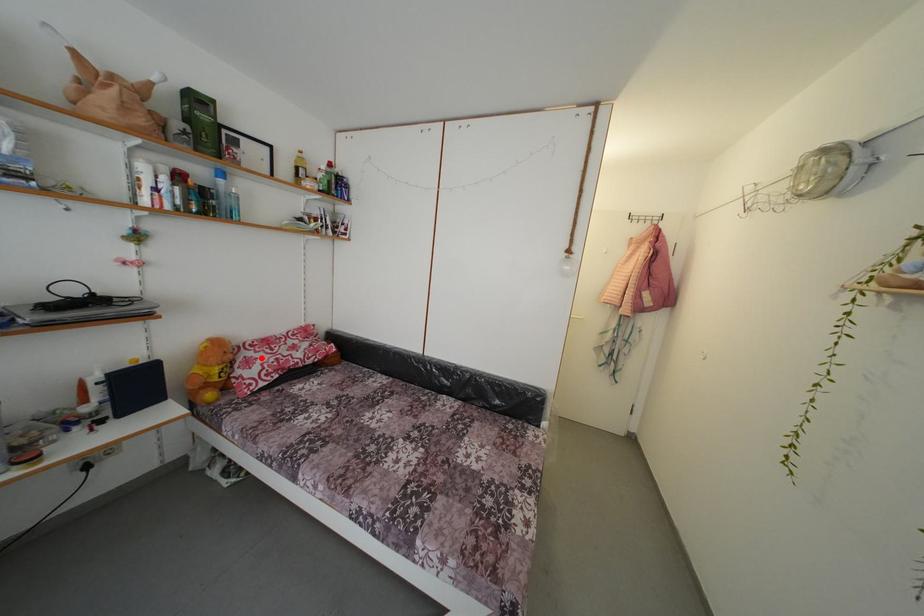
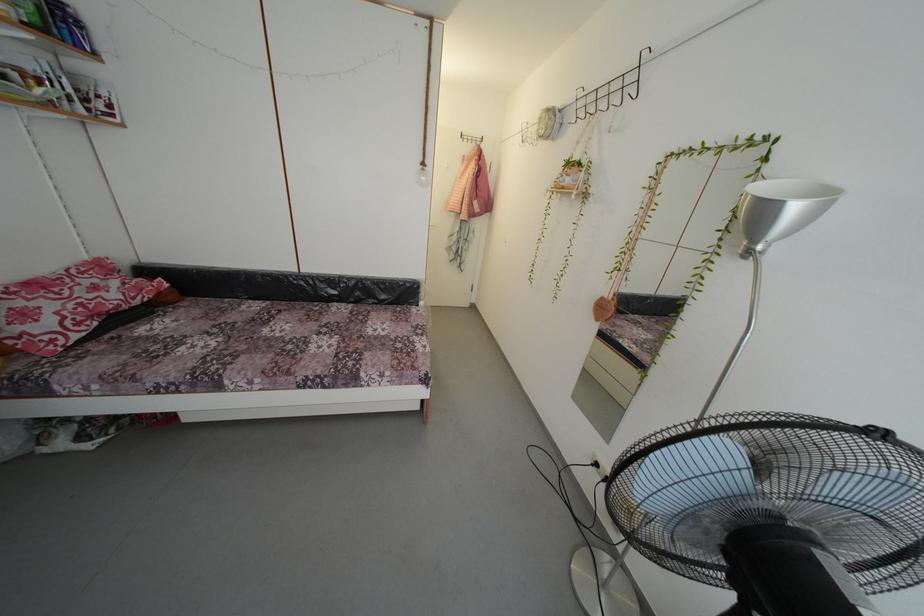
Question: I am providing you with two images of the same scene from different viewpoints. A red point is shown in image1. For the corresponding object point in image2, is it positioned nearer or farther from the camera?

Choices:
 (A) Nearer
 (B) Farther

Answer: (B)